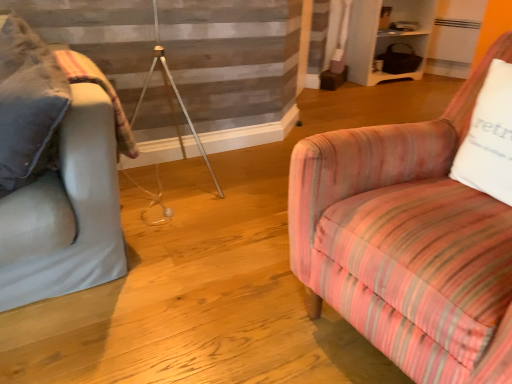
Where is `vacant space to the left of pink striped fabric chair at right`? The height and width of the screenshot is (384, 512). vacant space to the left of pink striped fabric chair at right is located at coordinates (221, 288).